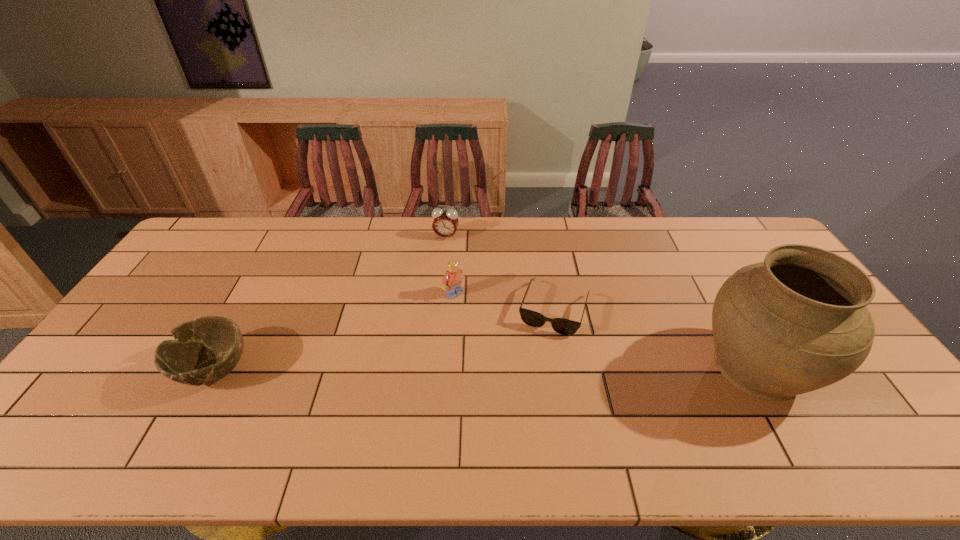
Image resolution: width=960 pixels, height=540 pixels. I want to click on free space on the desktop that is between the fourth tallest object and the rightmost object and is positioned at the front lenses of the shortest object, so click(536, 368).

You are a GUI agent. You are given a task and a screenshot of the screen. Output one action in this format:
    pyautogui.click(x=<x>, y=<y>)
    Task: Click on the vacant space on the desktop that is between the leftmost object and the urn and is positioned on the clock face of the alarm clock
    This screenshot has height=540, width=960.
    Given the screenshot: What is the action you would take?
    pyautogui.click(x=408, y=368)

Where is `vacant spot on the desktop that is between the leftmost object and the tallest object and is positioned on the front-facing side of the Lego`? This screenshot has width=960, height=540. vacant spot on the desktop that is between the leftmost object and the tallest object and is positioned on the front-facing side of the Lego is located at coordinates (546, 368).